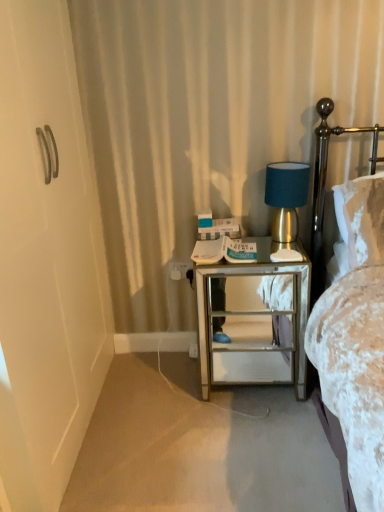
This screenshot has width=384, height=512. Find the location of `free location in front of clear glass nightstand at center`. free location in front of clear glass nightstand at center is located at coordinates (255, 438).